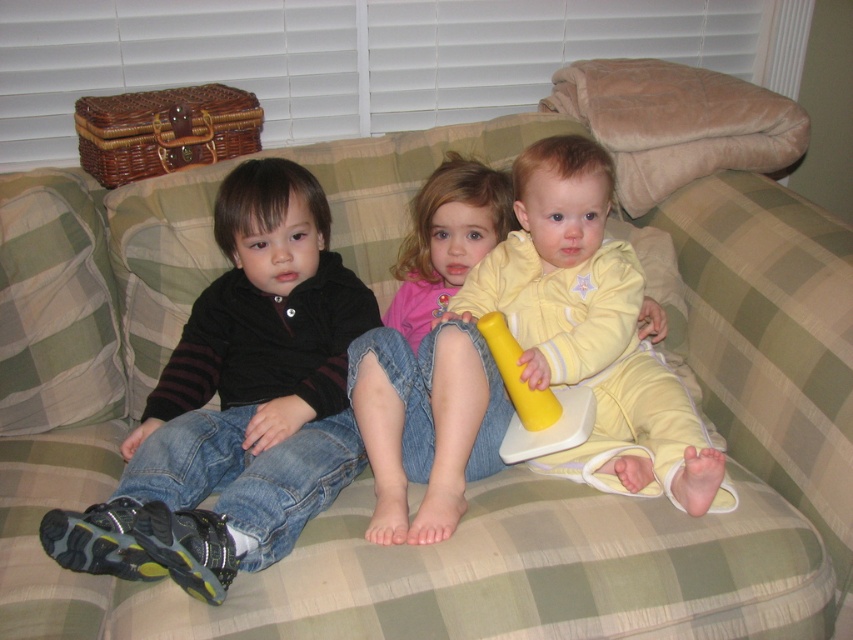
You are a parent trying to organize toys in the living room. You see the yellow rubber hammer at center and the pink fabric shirt at center. Which item should you place in the toy box first if you want to start with the taller item?

The yellow rubber hammer at center has a greater height compared to the pink fabric shirt at center, so you should place the yellow rubber hammer at center in the toy box first.

Looking at this image, you are taking a photo of the children on the couch and notice two points in the image. The first point is at coordinate point (265, 280) and the second is at point (430, 532). Which point is closer to the camera?

Point (265, 280) is further to the camera than point (430, 532), so the point closer to the camera is point (430, 532).